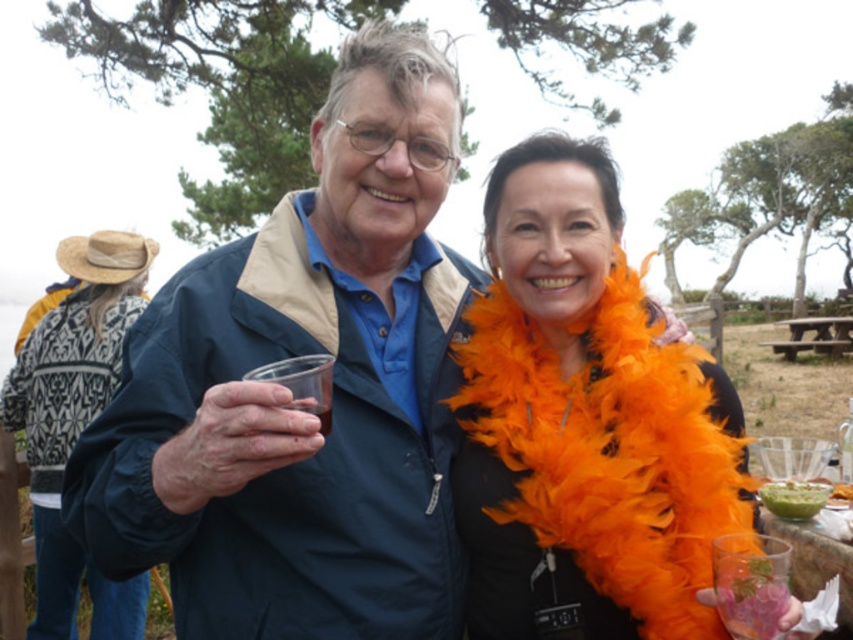
The image size is (853, 640). I want to click on blue fabric jacket at center, so click(288, 394).

Between point (450, 253) and point (846, 330), which one is positioned in front?

Point (450, 253)

Which is in front, point (212, 252) or point (773, 342)?

Point (212, 252) is more forward.

You are a GUI agent. You are given a task and a screenshot of the screen. Output one action in this format:
    pyautogui.click(x=<x>, y=<y>)
    Task: Click on the blue fabric jacket at center
    The height and width of the screenshot is (640, 853).
    Given the screenshot: What is the action you would take?
    pyautogui.click(x=288, y=394)

This screenshot has height=640, width=853. What are the coordinates of `wooden picnic table at center` in the screenshot? It's located at (815, 337).

This screenshot has width=853, height=640. I want to click on wooden picnic table at center, so click(x=815, y=337).

Where is `wooden picnic table at center`? The width and height of the screenshot is (853, 640). wooden picnic table at center is located at coordinates (815, 337).

Image resolution: width=853 pixels, height=640 pixels. What do you see at coordinates (584, 422) in the screenshot?
I see `orange feather boa at center` at bounding box center [584, 422].

Does point (573, 525) come closer to viewer compared to point (108, 384)?

Yes, point (573, 525) is closer to viewer.

Where is `orange feather boa at center`? The image size is (853, 640). orange feather boa at center is located at coordinates (584, 422).

At what (x,y) coordinates should I click in order to perform the action: click on orange feather boa at center. Please return your answer as a coordinate pair (x, y). This screenshot has width=853, height=640. Looking at the image, I should click on (584, 422).